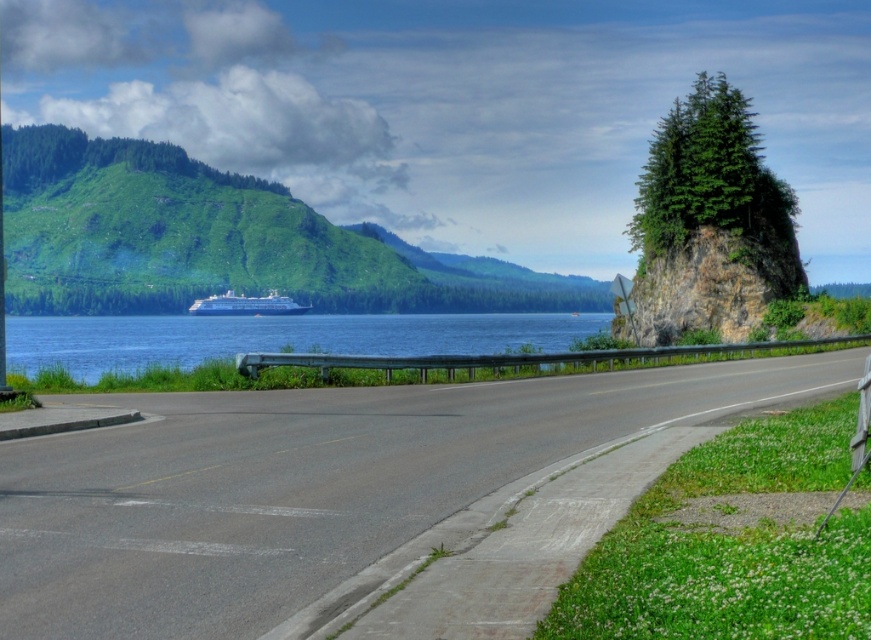
Question: Can you confirm if green grassy hillside at left is wider than metallic reflective sign at upper right?

Choices:
 (A) yes
 (B) no

Answer: (A)

Question: Which point is closer to the camera?

Choices:
 (A) green grassy hillside at left
 (B) asphalt road at center

Answer: (B)

Question: Does blue water at center lie in front of white glossy cruise ship at center?

Choices:
 (A) no
 (B) yes

Answer: (B)

Question: Which object is farther from the camera taking this photo?

Choices:
 (A) white glossy cruise ship at center
 (B) metallic reflective sign at upper right

Answer: (A)

Question: Among these objects, which one is nearest to the camera?

Choices:
 (A) metallic reflective sign at upper right
 (B) green grassy hillside at left
 (C) blue water at center
 (D) white glossy cruise ship at center

Answer: (C)

Question: Can you confirm if asphalt road at center is positioned above blue water at center?

Choices:
 (A) no
 (B) yes

Answer: (A)